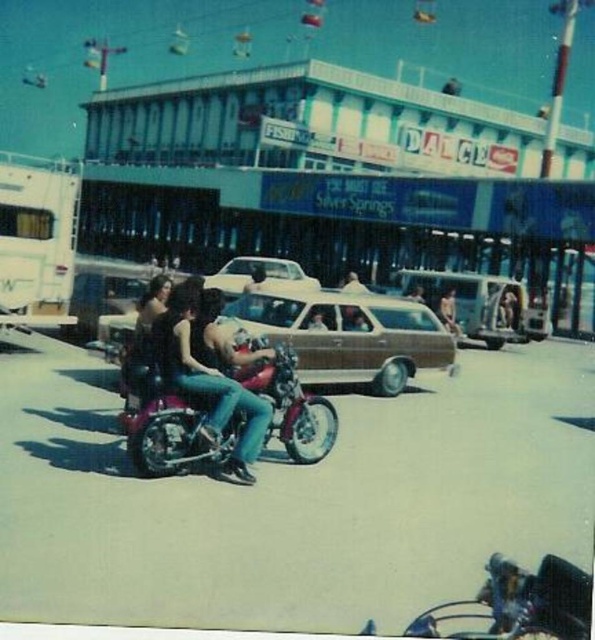
Locate an element on the screen. This screenshot has height=640, width=595. shiny chrome motorcycle at center is located at coordinates (171, 426).

Which of these two, shiny chrome motorcycle at center or white matte sedan at center, stands taller?

white matte sedan at center is taller.

Between point (303, 397) and point (283, 269), which one is positioned in front?

Point (303, 397) is more forward.

The height and width of the screenshot is (640, 595). In order to click on shiny chrome motorcycle at center in this screenshot , I will do `click(171, 426)`.

Does point (270, 304) come farther from viewer compared to point (309, 284)?

No, (270, 304) is closer to viewer.

Can you confirm if brown matte station wagon at center is shorter than white matte sedan at center?

Indeed, brown matte station wagon at center has a lesser height compared to white matte sedan at center.

Image resolution: width=595 pixels, height=640 pixels. Describe the element at coordinates (349, 336) in the screenshot. I see `brown matte station wagon at center` at that location.

You are a GUI agent. You are given a task and a screenshot of the screen. Output one action in this format:
    pyautogui.click(x=<x>, y=<y>)
    Task: Click on the brown matte station wagon at center
    
    Given the screenshot: What is the action you would take?
    pyautogui.click(x=349, y=336)

Between brown matte station wagon at center and shiny chrome motorcycle at lower right, which one appears on the right side from the viewer's perspective?

brown matte station wagon at center

How far apart are brown matte station wagon at center and shiny chrome motorcycle at lower right?

A distance of 21.89 feet exists between brown matte station wagon at center and shiny chrome motorcycle at lower right.

I want to click on brown matte station wagon at center, so click(349, 336).